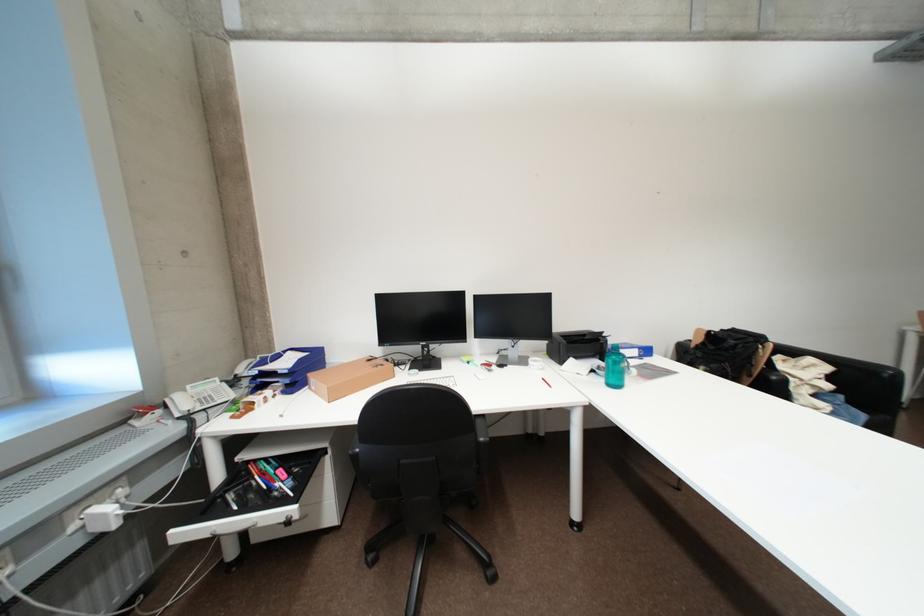
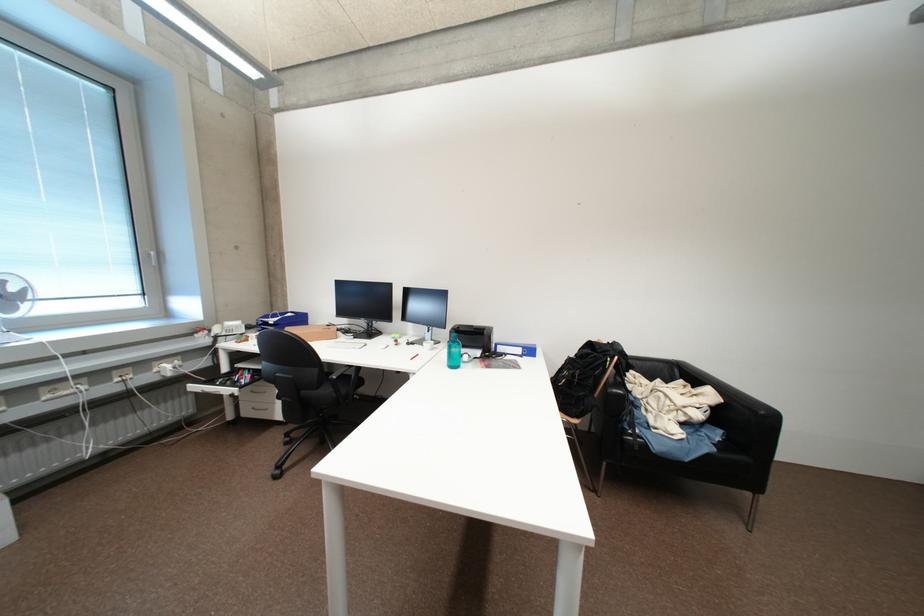
The point at (849, 399) is marked in the first image. Where is the corresponding point in the second image?

(727, 434)